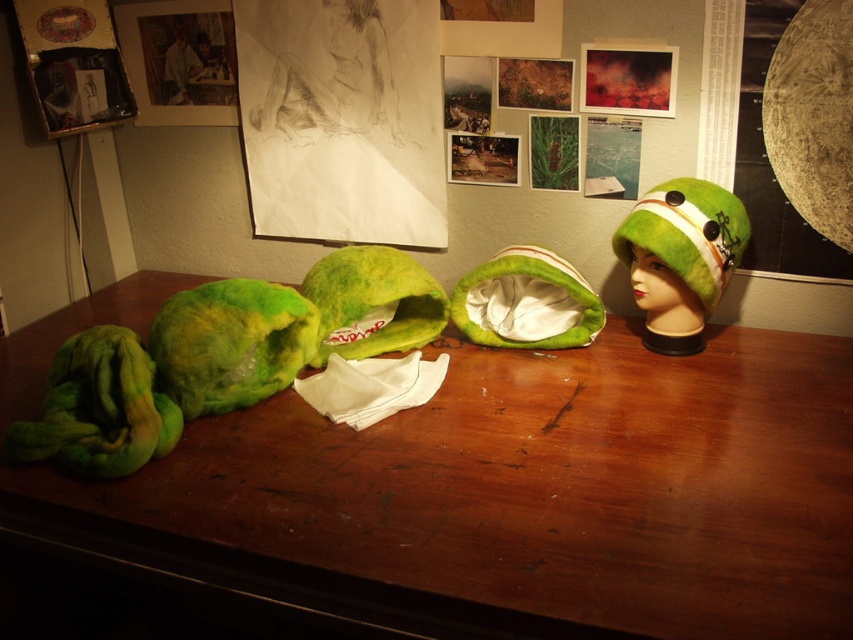
Question: Does green felted hat at center have a larger size compared to green felt hat at right?

Choices:
 (A) no
 (B) yes

Answer: (B)

Question: Can you confirm if green felted hat at center is thinner than green felt hat at right?

Choices:
 (A) yes
 (B) no

Answer: (B)

Question: Among these objects, which one is nearest to the camera?

Choices:
 (A) green felted hat at center
 (B) green felt hat at right

Answer: (A)

Question: From the image, what is the correct spatial relationship of green felted hat at center in relation to green felt hat at right?

Choices:
 (A) right
 (B) left

Answer: (B)

Question: Which of the following is the farthest from the observer?

Choices:
 (A) green felted hat at center
 (B) green felt hat at right

Answer: (B)